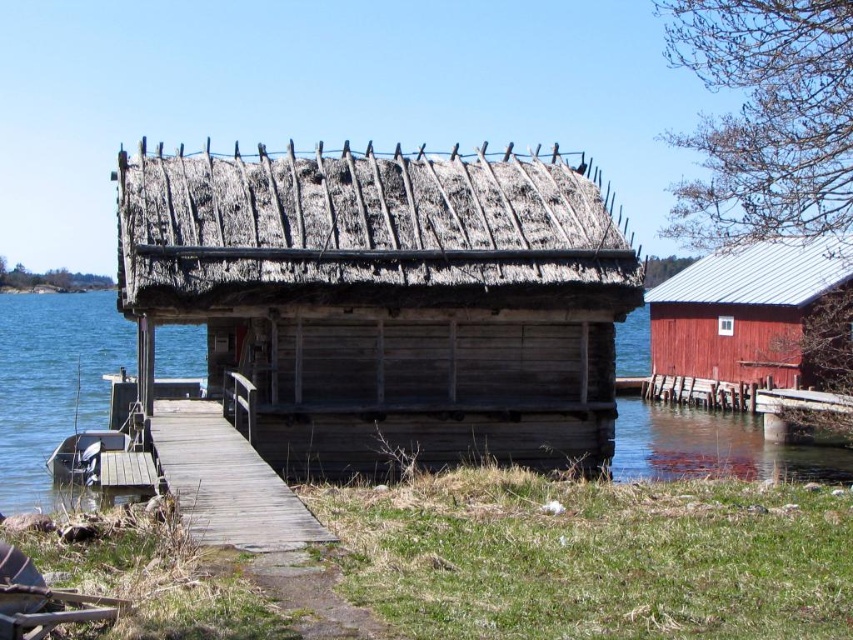
Question: Among these points, which one is nearest to the camera?

Choices:
 (A) (680, 324)
 (B) (21, 308)

Answer: (A)

Question: Can you confirm if wooden thatched cabin at center is positioned below metallic red cabin at right?

Choices:
 (A) no
 (B) yes

Answer: (A)

Question: Which of the following is the closest to the observer?

Choices:
 (A) (798, 385)
 (B) (1, 392)

Answer: (A)

Question: Is clear water at dock center to the left of clear water at dock left from the viewer's perspective?

Choices:
 (A) no
 (B) yes

Answer: (A)

Question: Is clear water at dock center positioned before wooden planks at center?

Choices:
 (A) yes
 (B) no

Answer: (B)

Question: Which point is farther to the camera?

Choices:
 (A) clear water at dock left
 (B) metallic gray boat at lower left
 (C) clear water at dock center

Answer: (A)